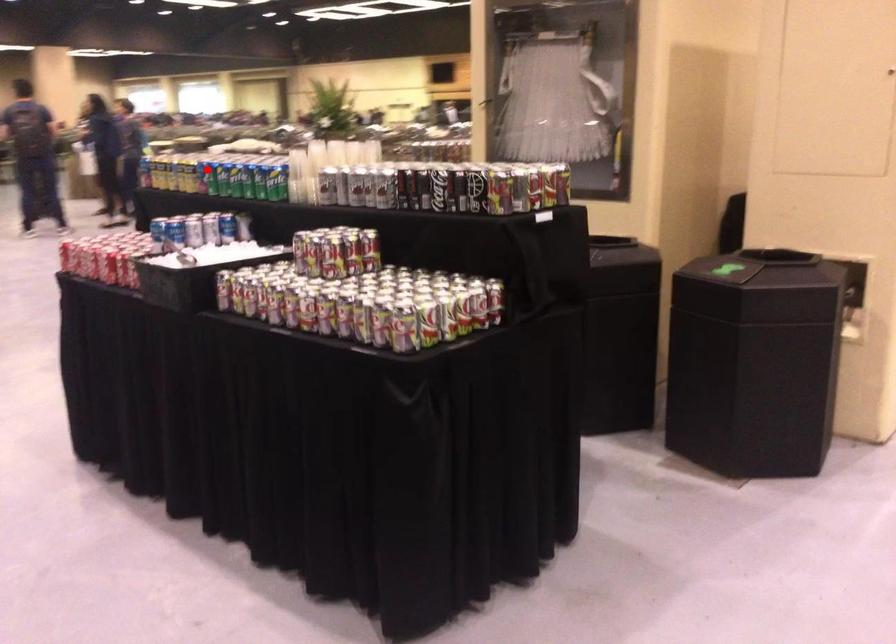
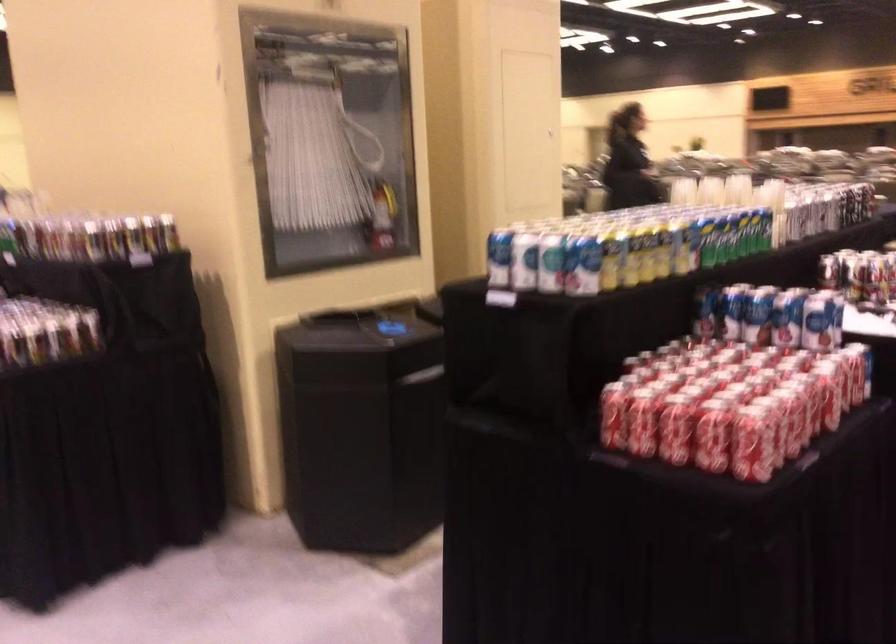
In the second image, find the point that corresponds to the highlighted location in the first image.

(722, 238)